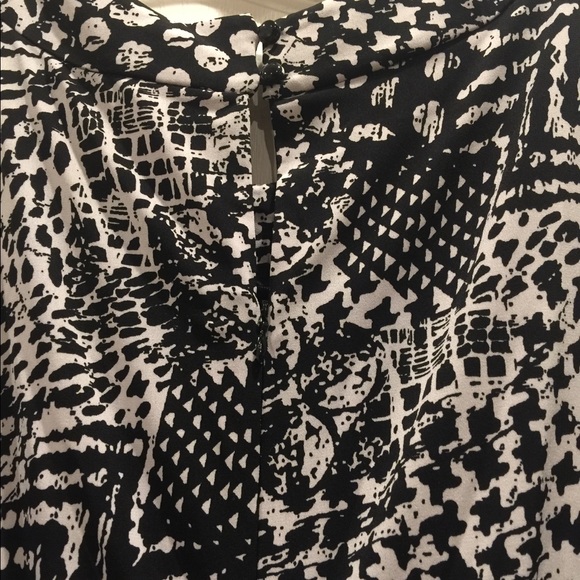
Locate an element on the screen. textured wall is located at coordinates click(x=263, y=139), click(x=264, y=10), click(x=260, y=50).